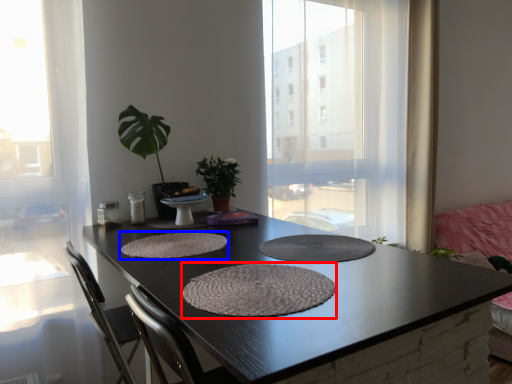
Question: Which object is closer to the camera taking this photo, wide (highlighted by a red box) or wide (highlighted by a blue box)?

Choices:
 (A) wide
 (B) wide

Answer: (A)